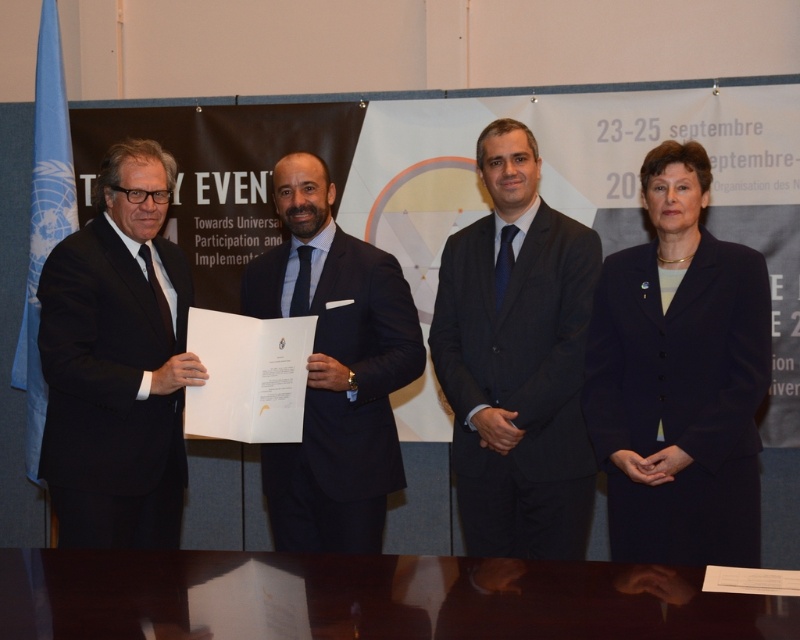
Between dark blue suit at center and black matte suit at center, which one is positioned lower?

black matte suit at center

Which is behind, point (501, 477) or point (374, 298)?

Positioned behind is point (501, 477).

Is point (504, 342) closer to camera compared to point (385, 452)?

No, it is not.

Where is `dark blue suit at center`? The image size is (800, 640). dark blue suit at center is located at coordinates (517, 360).

Is glossy wooden table at lower center positioned in front of dark blue suit at center?

Yes.

Does point (34, 568) lie in front of point (486, 182)?

That is True.

Which is behind, point (624, 637) or point (558, 404)?

Positioned behind is point (558, 404).

The width and height of the screenshot is (800, 640). I want to click on glossy wooden table at lower center, so click(x=382, y=596).

Is the position of dark blue suit at right less distant than that of dark blue suit at center?

Yes, it is.

Is dark blue suit at right behind dark blue suit at center?

No.

Is point (645, 388) farther from viewer compared to point (496, 198)?

No, it is not.

Where is `dark blue suit at right`? This screenshot has width=800, height=640. dark blue suit at right is located at coordinates (680, 378).